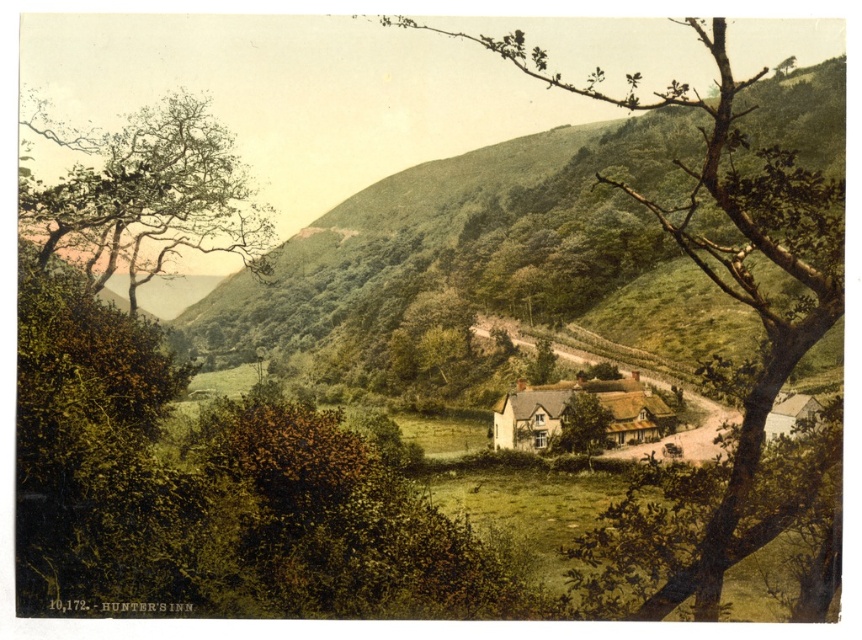
Question: Does green leafy hillside at center come in front of green leafy tree at center?

Choices:
 (A) yes
 (B) no

Answer: (B)

Question: Observing the image, what is the correct spatial positioning of green leafy tree at center in reference to thatched roof cottage at center?

Choices:
 (A) above
 (B) below

Answer: (A)

Question: Which object is the closest to the green leafy tree at center?

Choices:
 (A) green leafy hillside at center
 (B) thatched roof cottage at center
 (C) green leafy tree at upper left

Answer: (A)

Question: Which object is farther from the camera taking this photo?

Choices:
 (A) thatched roof cottage at center
 (B) green leafy tree at upper left

Answer: (A)

Question: Is green leafy tree at center to the right of green leafy tree at upper left from the viewer's perspective?

Choices:
 (A) yes
 (B) no

Answer: (A)

Question: Which of the following is the closest to the observer?

Choices:
 (A) green leafy hillside at center
 (B) green leafy tree at upper left

Answer: (A)